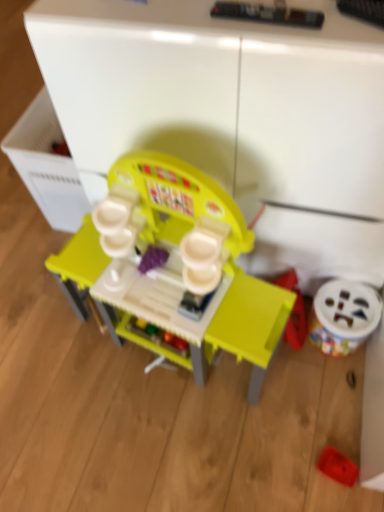
Where is `free space in front of white plastic toy at lower right, the third toy when ordered from left to right`? This screenshot has width=384, height=512. free space in front of white plastic toy at lower right, the third toy when ordered from left to right is located at coordinates (331, 388).